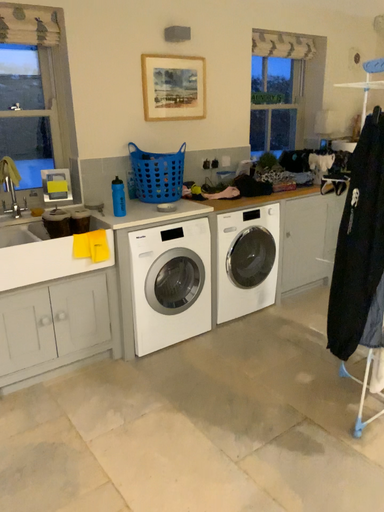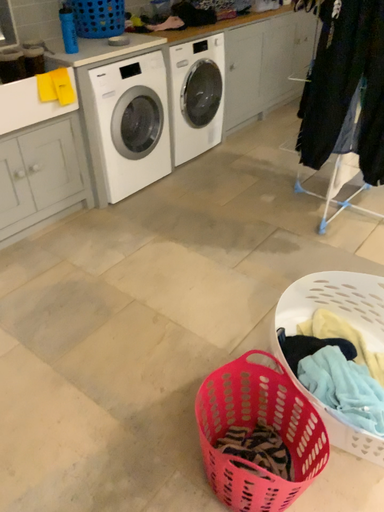
Question: How did the camera likely rotate when shooting the video?

Choices:
 (A) rotated right
 (B) rotated left

Answer: (A)